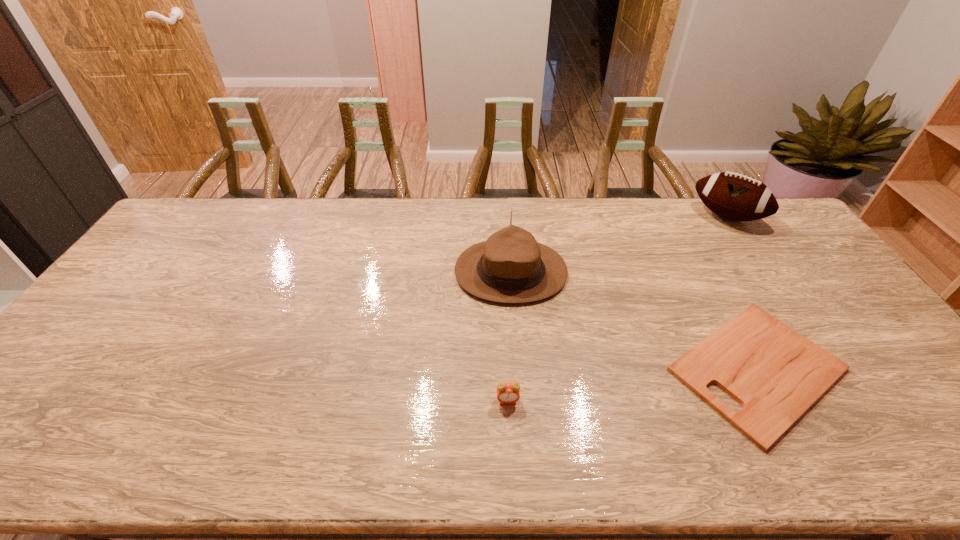
Identify which object is the third closest to the second shortest object. Please provide its 2D coordinates. Your answer should be formatted as a tuple, i.e. [(x, y)], where the tuple contains the x and y coordinates of a point satisfying the conditions above.

[(734, 196)]

Find the location of a particular element. This screenshot has width=960, height=540. object that is the third closest to the second shortest object is located at coordinates (734, 196).

Where is `vacant area in the image that satisfies the following two spatial constraints: 1. on the feather side of the fedora; 2. on the face of the alarm clock`? vacant area in the image that satisfies the following two spatial constraints: 1. on the feather side of the fedora; 2. on the face of the alarm clock is located at coordinates (520, 401).

This screenshot has width=960, height=540. Identify the location of vacant point that satisfies the following two spatial constraints: 1. on the feather side of the third nearest object; 2. on the face of the alarm clock. (520, 401).

The image size is (960, 540). I want to click on free location that satisfies the following two spatial constraints: 1. on the feather side of the chopping board; 2. on the right side of the second farthest object, so click(x=518, y=369).

Locate an element on the screen. The width and height of the screenshot is (960, 540). vacant region that satisfies the following two spatial constraints: 1. on the feather side of the fedora; 2. on the face of the alarm clock is located at coordinates (520, 401).

Identify the location of free region that satisfies the following two spatial constraints: 1. on the feather side of the shortest object; 2. on the right side of the third nearest object. (518, 369).

Locate an element on the screen. The height and width of the screenshot is (540, 960). vacant space that satisfies the following two spatial constraints: 1. on the feather side of the fedora; 2. on the face of the third tallest object is located at coordinates (520, 401).

This screenshot has width=960, height=540. I want to click on blank area in the image that satisfies the following two spatial constraints: 1. on the feather side of the chopping board; 2. on the left side of the third nearest object, so click(x=518, y=369).

The height and width of the screenshot is (540, 960). Identify the location of free point that satisfies the following two spatial constraints: 1. on the feather side of the third nearest object; 2. on the right side of the chopping board. (518, 369).